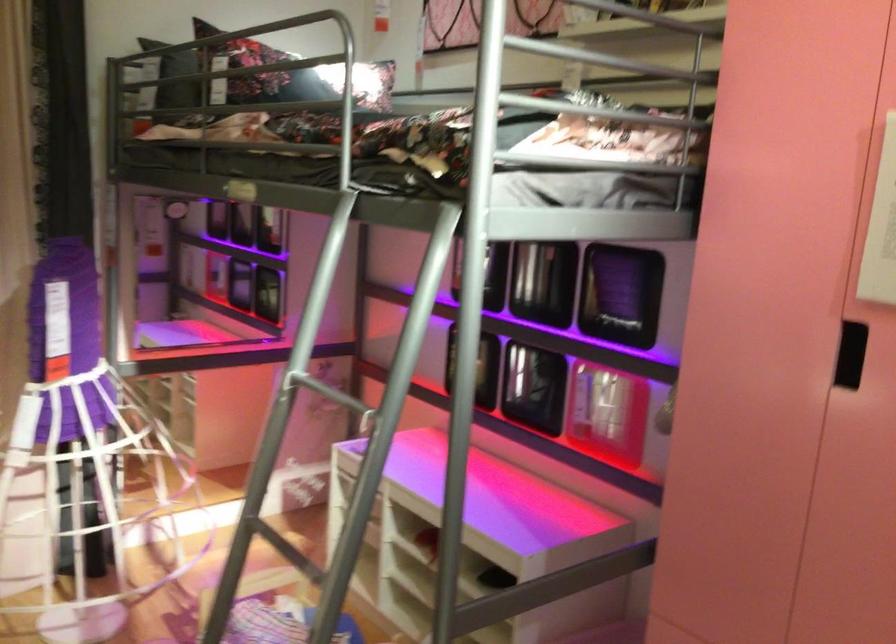
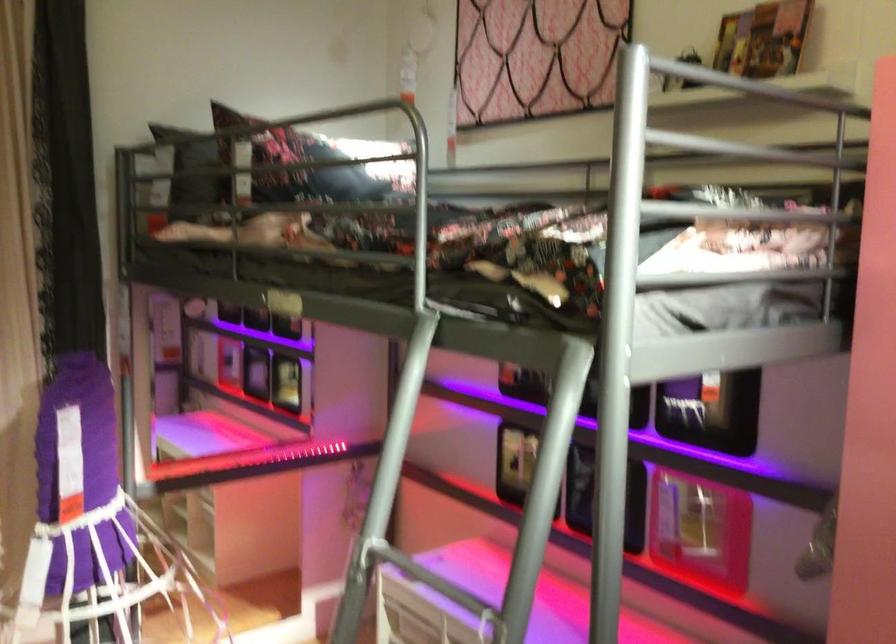
Question: How did the camera likely rotate?

Choices:
 (A) Left
 (B) Right
 (C) Up
 (D) Down

Answer: (C)